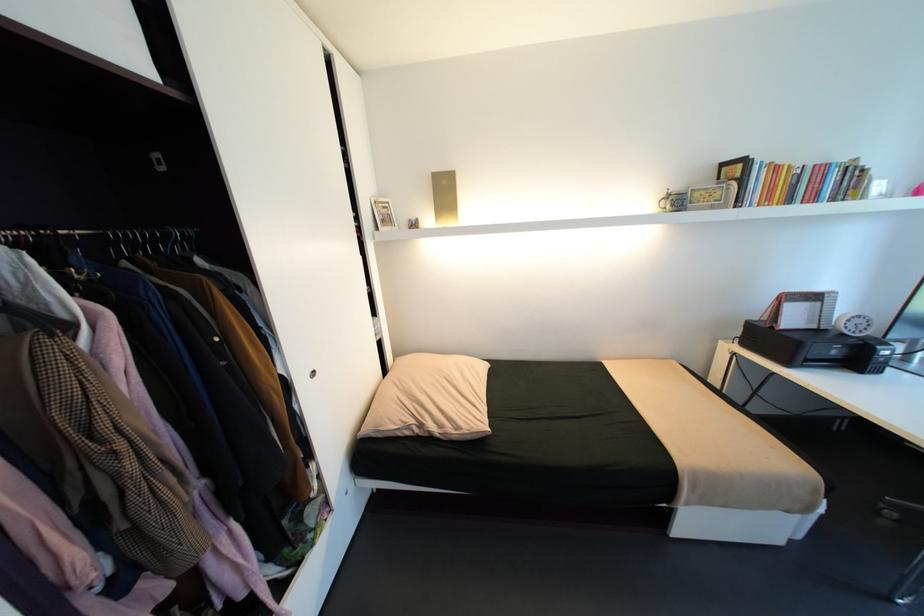
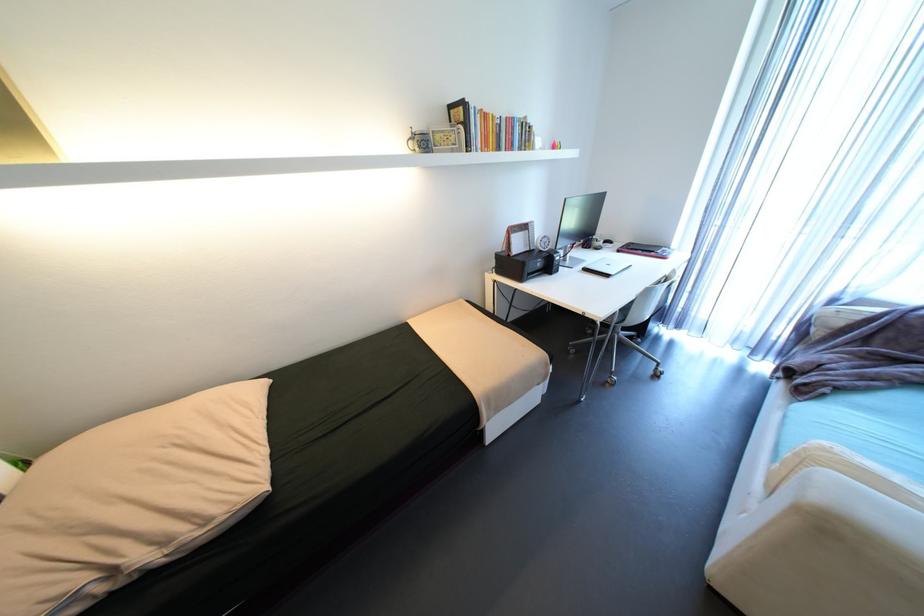
Question: The images are taken continuously from a first-person perspective. In which direction is your viewpoint rotating?

Choices:
 (A) Left
 (B) Right
 (C) Up
 (D) Down

Answer: (B)